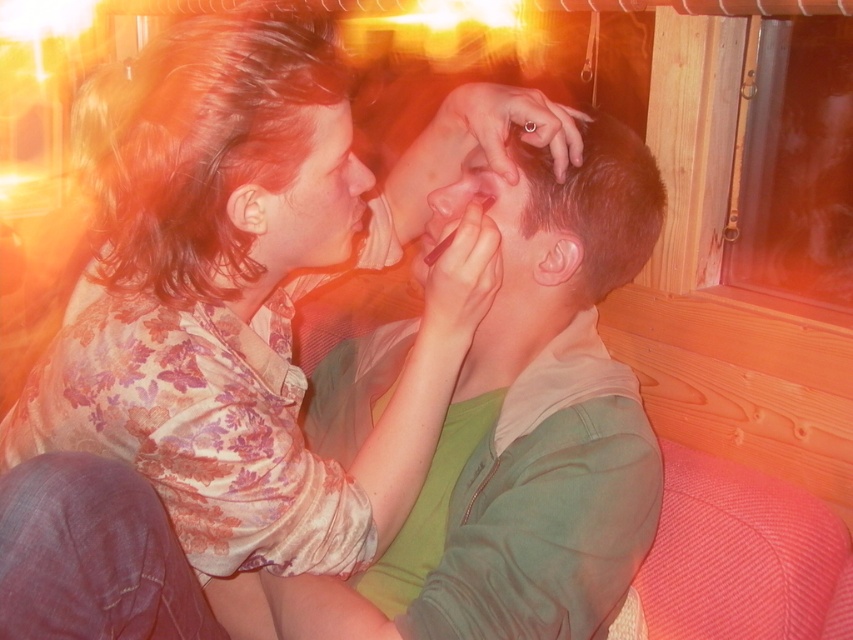
You are a makeup artist who needs to ensure proper spacing between the matte floral shirt at upper left and the matte skin at center to avoid smudging. Given that your brush has a 3.5 inch diameter, can you safely apply makeup without the shirt getting in the way?

The distance between the matte floral shirt at upper left and the matte skin at center is 6.58 inches. Since the brush diameter is 3.5 inches, there is enough space to apply makeup without the shirt getting in the way as the distance is greater than the brush size.

You are a tailor measuring two floral shirts for alterations. The floral silk blouse at center and the matte floral shirt at upper left need to be adjusted to be exactly 5 inches apart. Are they currently positioned correctly?

The floral silk blouse at center and the matte floral shirt at upper left are 4.90 inches apart, which is just 0.10 inches less than the required 5 inches. They are not positioned correctly and need to be moved slightly farther apart to meet the 5 inch requirement.

You are standing in the room and want to locate the matte floral shirt at upper left. Based on the coordinates provided, which object in the scene is closest to the point marked at (309,198)?

The point at (309,198) corresponds to the matte floral shirt at upper left, so the closest object is the matte floral shirt at upper left itself.